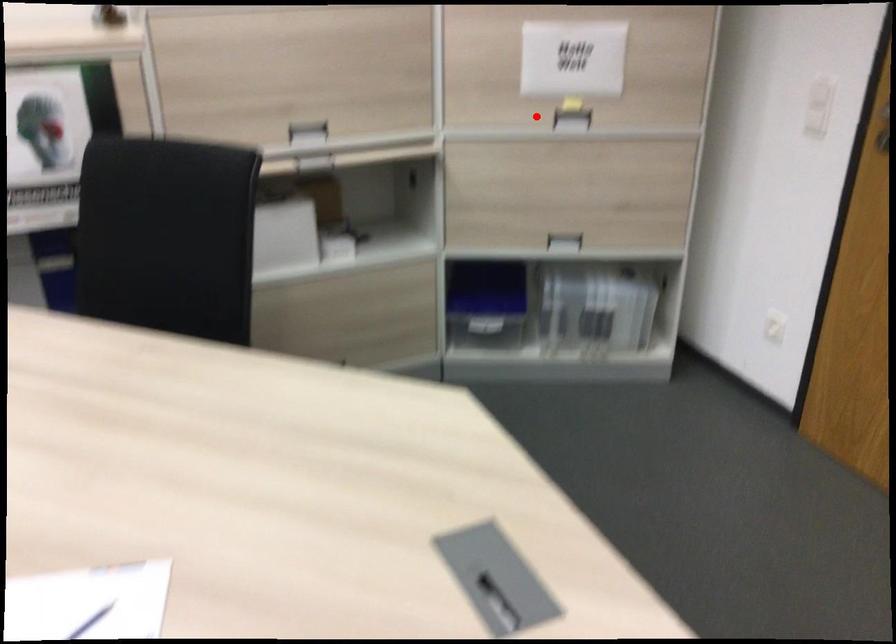
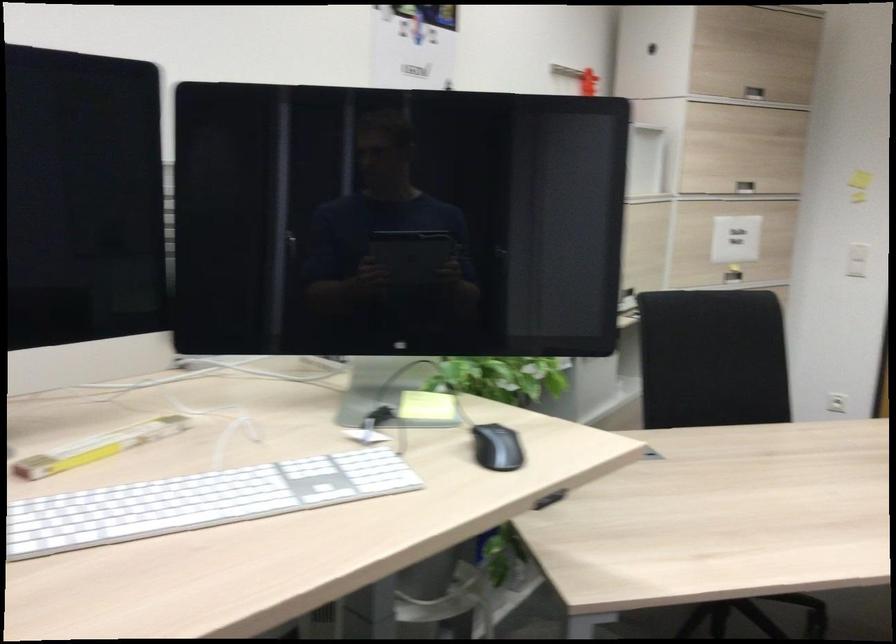
Question: I am providing you with two images of the same scene from different viewpoints. Given a red point in image1, look at the same physical point in image2. Is it:

Choices:
 (A) Closer to the viewpoint
 (B) Farther from the viewpoint

Answer: (B)